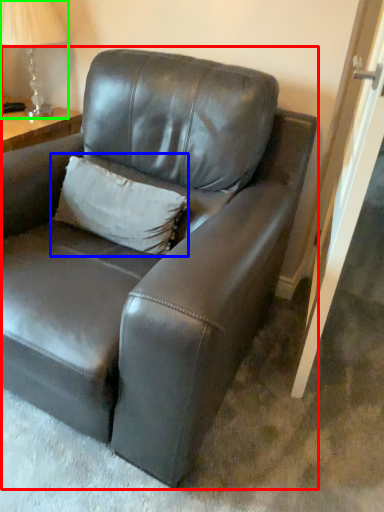
Question: Which is nearer to the studio couch (highlighted by a red box)? pillow (highlighted by a blue box) or table lamp (highlighted by a green box).

Choices:
 (A) pillow
 (B) table lamp

Answer: (A)